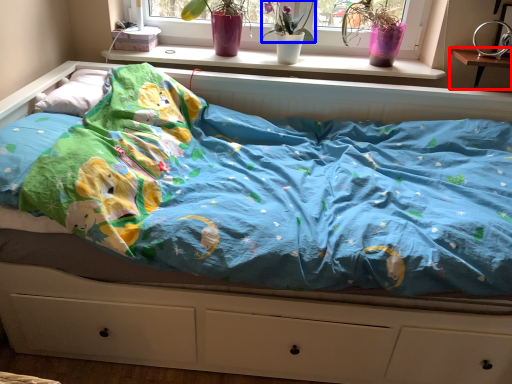
Question: Which object appears farthest to the camera in this image, changing table (highlighted by a red box) or floral arrangement (highlighted by a blue box)?

Choices:
 (A) changing table
 (B) floral arrangement

Answer: (B)